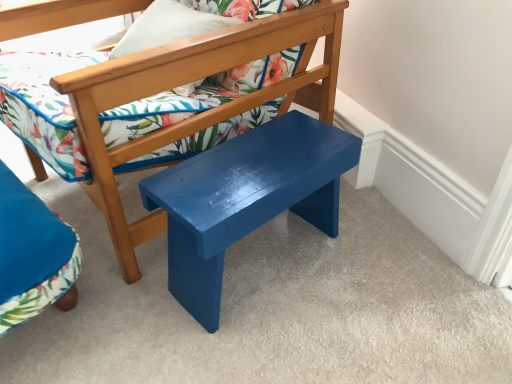
I want to click on unoccupied region to the right of glossy wood stool at center, so click(x=384, y=274).